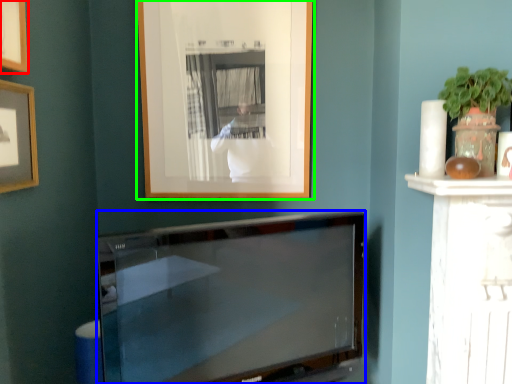
Question: Which object is positioned farthest from picture frame (highlighted by a red box)? Select from television (highlighted by a blue box) and picture frame (highlighted by a green box).

Choices:
 (A) television
 (B) picture frame

Answer: (A)